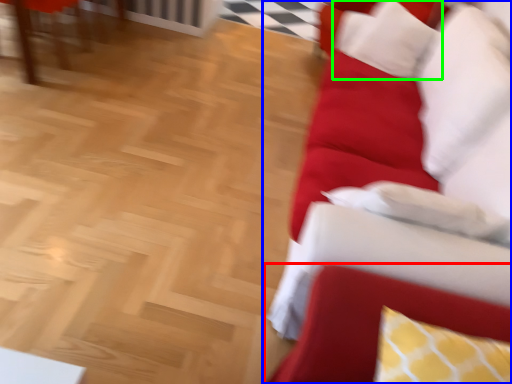
Question: Based on their relative distances, which object is nearer to swivel chair (highlighted by a red box)? Choose from studio couch (highlighted by a blue box) and pillow (highlighted by a green box).

Choices:
 (A) studio couch
 (B) pillow

Answer: (A)